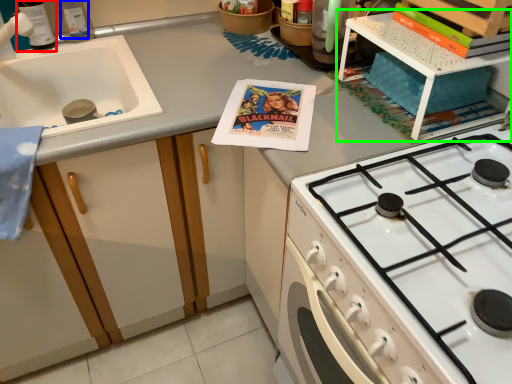
Question: Estimate the real-world distances between objects in this image. Which object is farther from bottle (highlighted by a red box), bottle (highlighted by a blue box) or shelf (highlighted by a green box)?

Choices:
 (A) bottle
 (B) shelf

Answer: (B)